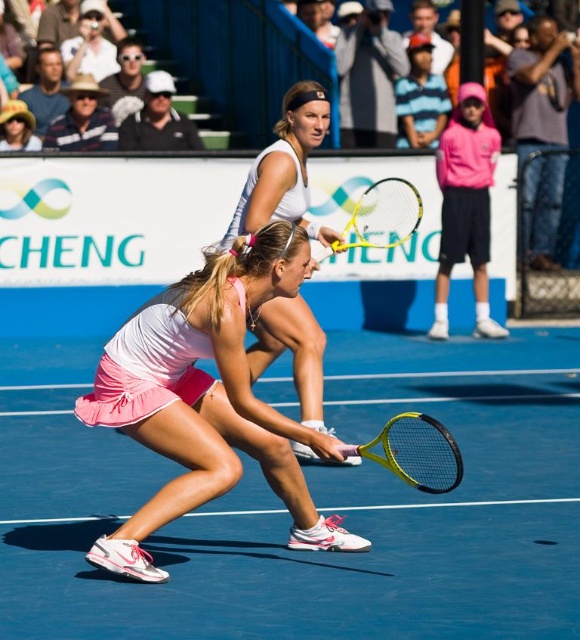
Based on the photo, you are a tennis ball in this match. You are currently at point (175, 490) and you want to move to point (441, 141). Will you be moving forward or backward relative to your current position?

Since point (175, 490) is in front of point (441, 141), moving from point (175, 490) to point (441, 141) would mean moving backward relative to your current position.